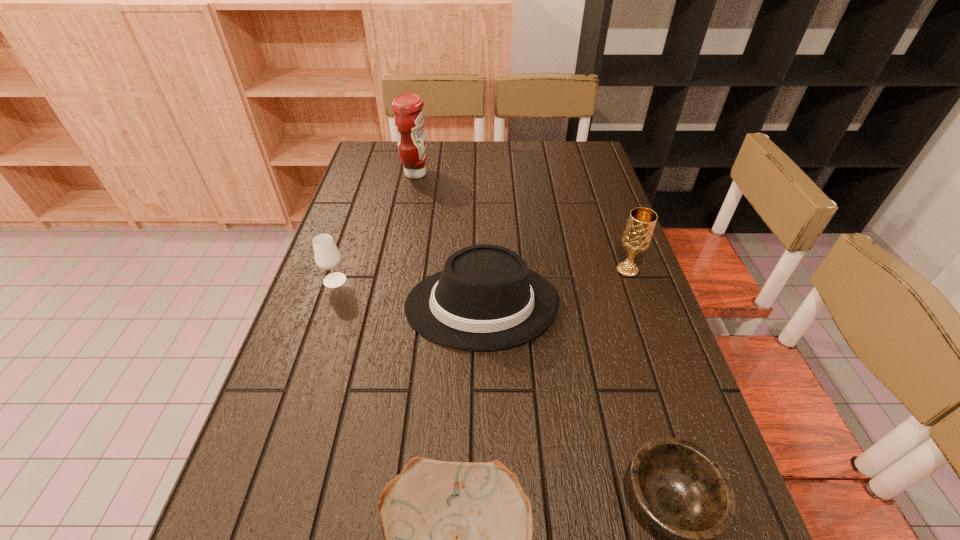
Find the location of a particular element. This screenshot has height=540, width=960. vacant space situated 0.110m on the back of the leftmost object is located at coordinates (347, 245).

Where is `object situated at the far edge`? object situated at the far edge is located at coordinates click(409, 117).

Where is `condiment that is at the left edge`? This screenshot has height=540, width=960. condiment that is at the left edge is located at coordinates (409, 117).

Where is `glass at the left edge`? The image size is (960, 540). glass at the left edge is located at coordinates (327, 256).

Where is `object that is positioned at the right edge`? object that is positioned at the right edge is located at coordinates (639, 229).

Find the location of a particular element. Image resolution: width=960 pixels, height=540 pixels. object that is positioned at the far left corner is located at coordinates (409, 117).

You are a GUI agent. You are given a task and a screenshot of the screen. Output one action in this format:
    pyautogui.click(x=<x>, y=<y>)
    Task: Click on the vacant space at the far edge of the desktop
    
    Given the screenshot: What is the action you would take?
    pyautogui.click(x=528, y=166)

You are a GUI agent. You are given a task and a screenshot of the screen. Output one action in this format:
    pyautogui.click(x=<x>, y=<y>)
    Task: Click on the free space at the left edge
    
    Given the screenshot: What is the action you would take?
    pyautogui.click(x=353, y=226)

This screenshot has width=960, height=540. What are the coordinates of `vacant area at the right edge of the desktop` in the screenshot? It's located at point(602,312).

Identify the location of vacant space at the far left corner. (393, 152).